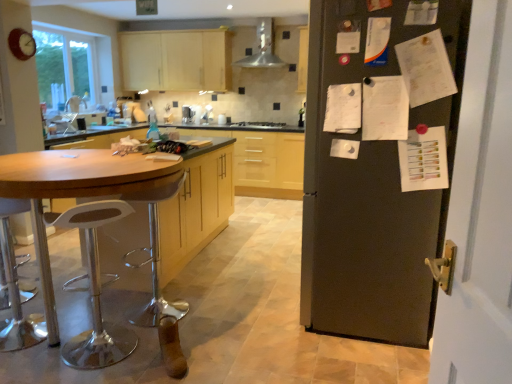
I want to click on free space behind metallic silver bar stool at left, placed as the 1th bar stool when sorted from back to front, so click(x=177, y=287).